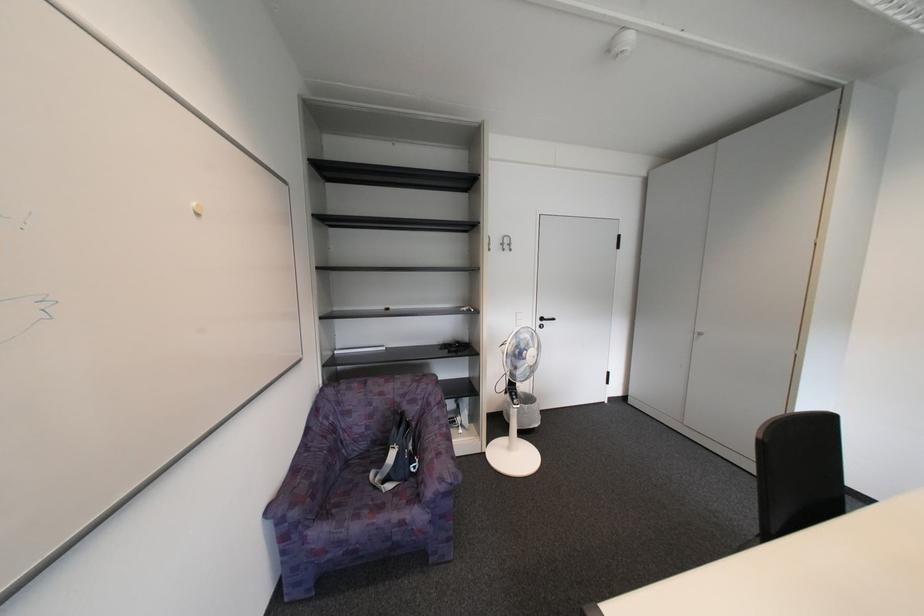
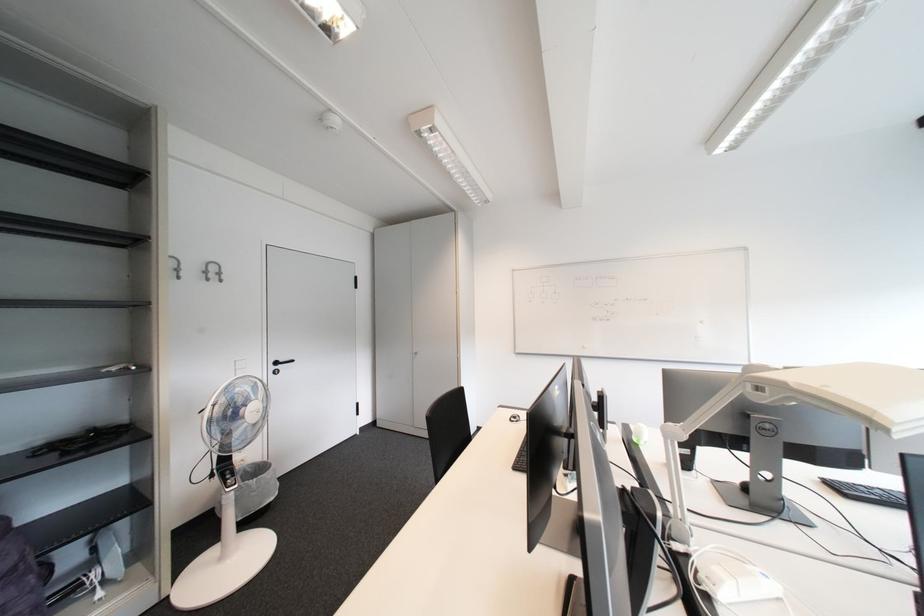
Question: Based on the continuous images, in which direction is the camera rotating? Reply with the corresponding letter.

Choices:
 (A) Left
 (B) Right
 (C) Up
 (D) Down

Answer: (B)